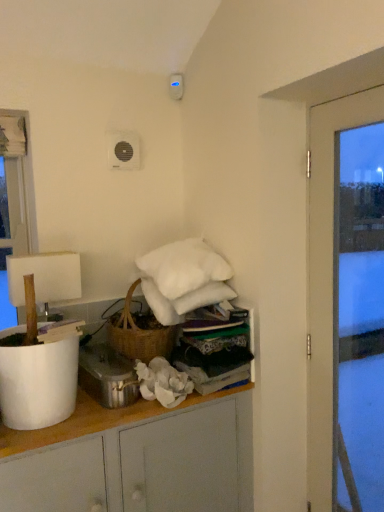
Question: In terms of size, does transparent glass door at right appear bigger or smaller than white matte cabinet at center?

Choices:
 (A) big
 (B) small

Answer: (B)

Question: Visually, is transparent glass door at right positioned to the left or to the right of white matte cabinet at center?

Choices:
 (A) left
 (B) right

Answer: (B)

Question: Estimate the real-world distances between objects in this image. Which object is closer to the white fabric at upper center?

Choices:
 (A) white fluffy pillow at upper center
 (B) white matte cabinet at center
 (C) metallic silver pot at lower center
 (D) white matte lampshade at left
 (E) transparent glass door at right

Answer: (A)

Question: Estimate the real-world distances between objects in this image. Which object is closer to the white matte lampshade at left?

Choices:
 (A) transparent glass door at right
 (B) white matte cabinet at center
 (C) white fabric at upper center
 (D) white fluffy pillow at upper center
 (E) metallic silver pot at lower center

Answer: (E)